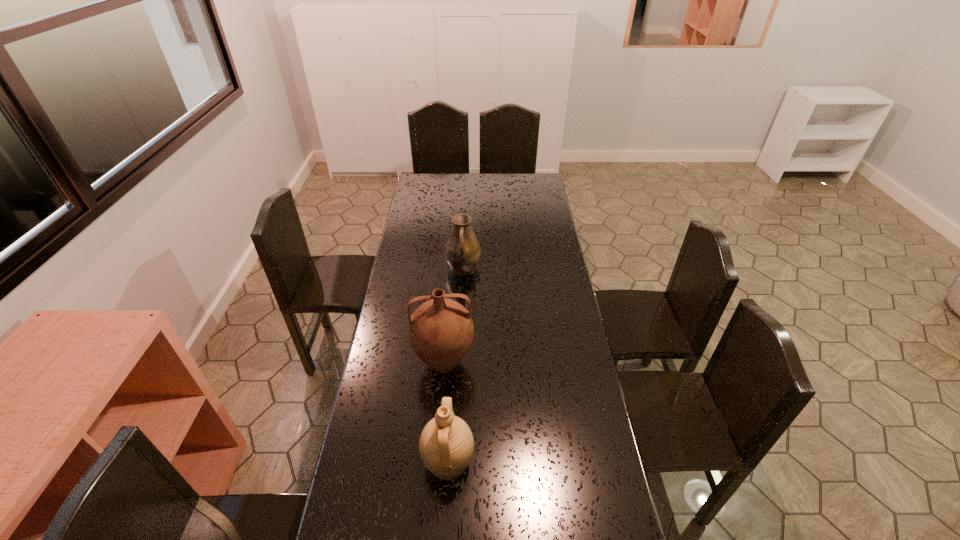
The image size is (960, 540). I want to click on free region at the right edge of the desktop, so click(530, 229).

I want to click on free space at the far right corner of the desktop, so click(x=520, y=191).

Locate which object is the closest to the nearest pitcher. Please provide its 2D coordinates. Your answer should be formatted as a tuple, i.e. [(x, y)], where the tuple contains the x and y coordinates of a point satisfying the conditions above.

[(441, 330)]

Locate an element on the screen. This screenshot has height=540, width=960. object that stands as the second closest to the nearest pitcher is located at coordinates (462, 251).

The image size is (960, 540). Find the location of `pitcher identified as the second closest to the farthest object`. pitcher identified as the second closest to the farthest object is located at coordinates (446, 444).

You are a GUI agent. You are given a task and a screenshot of the screen. Output one action in this format:
    pyautogui.click(x=<x>, y=<y>)
    Task: Click on the closest pitcher relative to the tallest object
    
    Given the screenshot: What is the action you would take?
    (x=446, y=444)